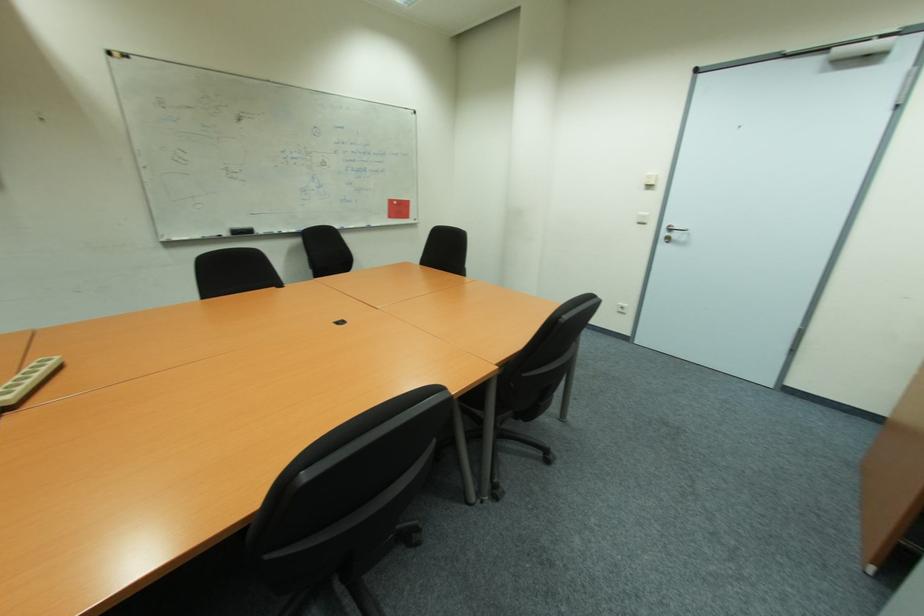
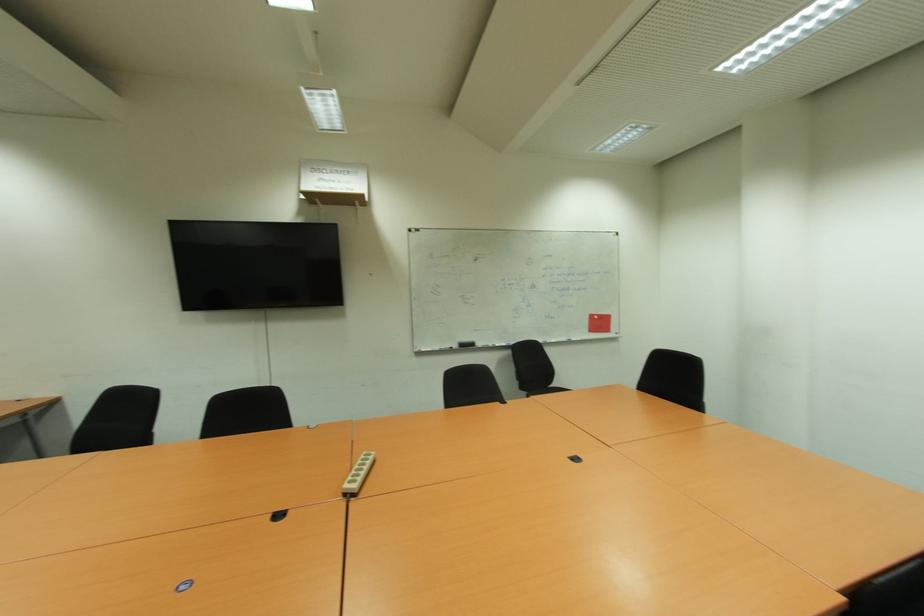
The point at (229, 233) is marked in the first image. Where is the corresponding point in the second image?

(457, 347)